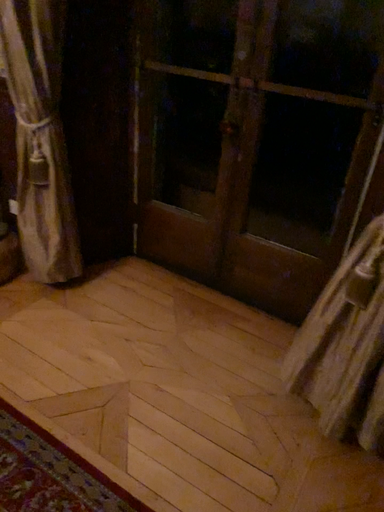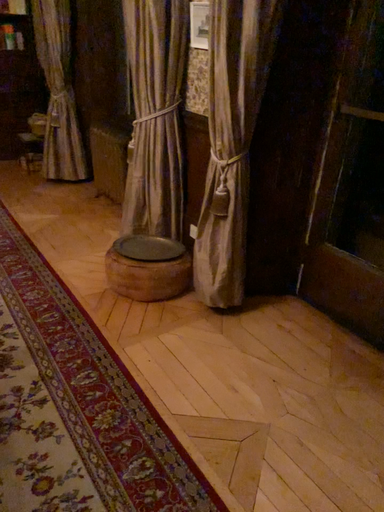
Question: How did the camera likely rotate when shooting the video?

Choices:
 (A) rotated left
 (B) rotated right

Answer: (A)